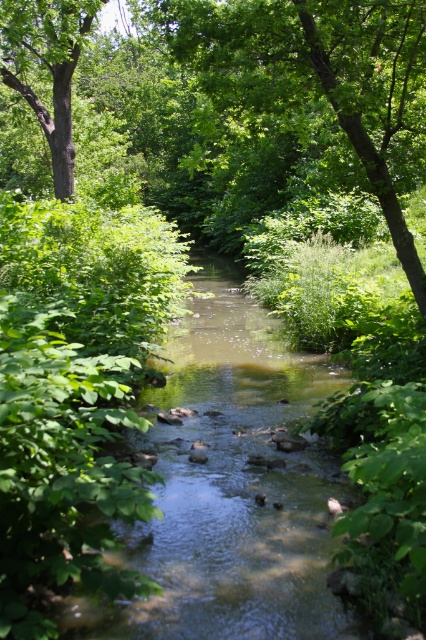
Which is more to the right, green leafy tree at center or brown rough tree at left?

green leafy tree at center

Describe the element at coordinates (321, 83) in the screenshot. This screenshot has width=426, height=640. I see `green leafy tree at center` at that location.

Find the location of `green leafy tree at center`. green leafy tree at center is located at coordinates (321, 83).